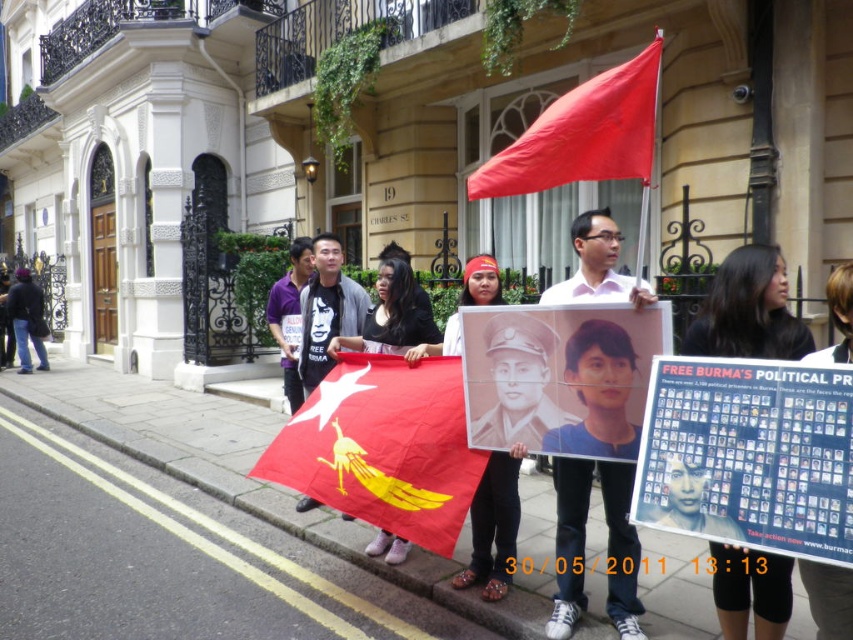
You are a photographer standing on the sidewalk capturing the protest scene. You notice the red fabric flag at center and the dark blue jeans at left. Which object is closer to the camera?

The dark blue jeans at left are closer to the camera because the red fabric flag at center is positioned under it, indicating it is behind the jeans.

You are a photographer standing at the origin point of the coordinate system. You want to capture both the point at (x=646, y=51) and the point at (x=331, y=314) in your photo. Which point should you focus on first to ensure both are in frame?

You should focus on point (x=646, y=51) first because it is closer to the photographer at the origin compared to point (x=331, y=314), ensuring both points are within the frame.